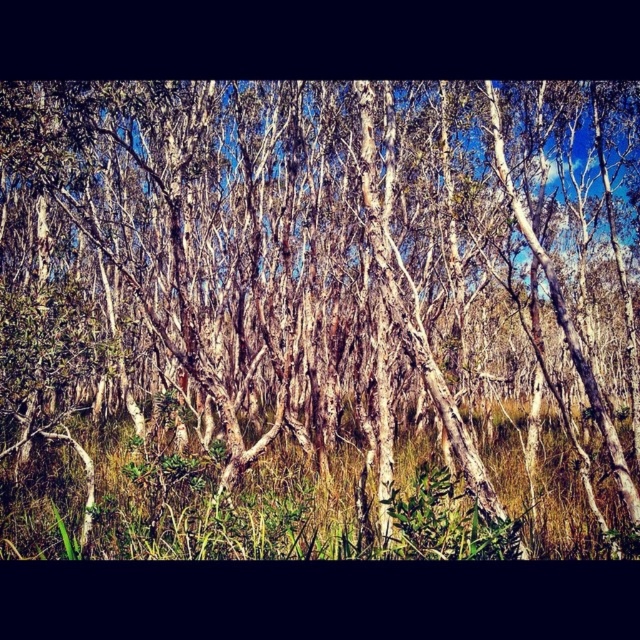
You are standing in the middle of the forest and want to walk towards the point closer to the camera. Which point should you head towards, point (376, 422) or point (180, 532)?

You should head towards point (180, 532) because it is closer to the camera than point (376, 422).

You are standing in the forest and see the white bark trees at center. Can you determine their exact location based on the coordinates provided?

The white bark trees at center are located at coordinates point (310,289).

You are a hiker who wants to cross a dense forest. You see the white bark trees at center and the green grass at lower center. How far apart are these two landmarks?

The white bark trees at center is 6.77 meters away from green grass at lower center.